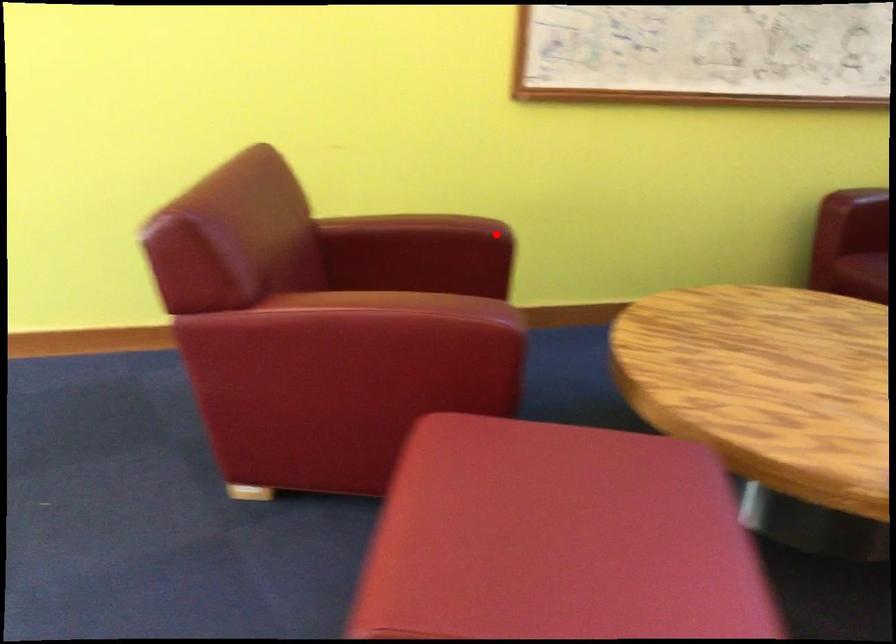
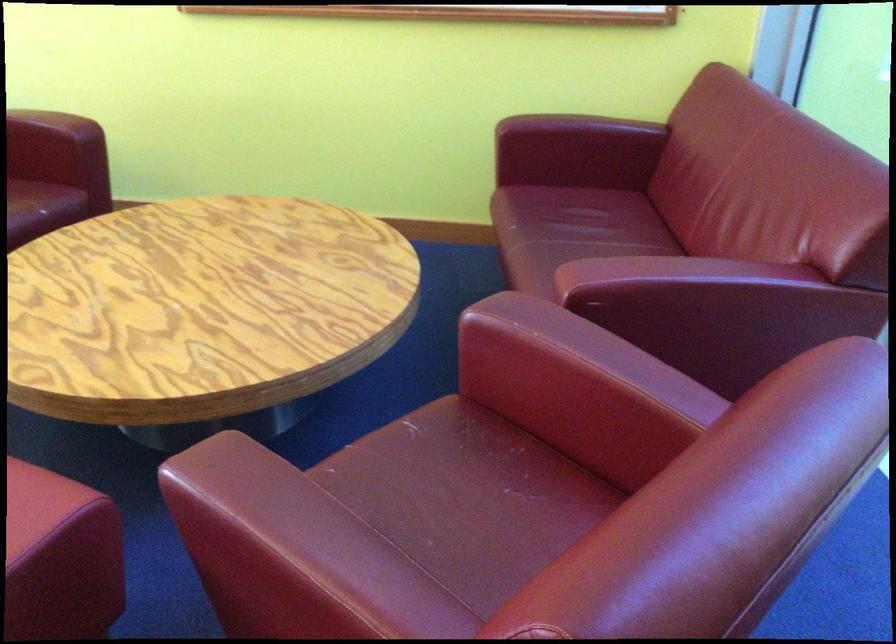
Locate, in the second image, the point that corresponds to the highlighted location in the first image.

(55, 122)